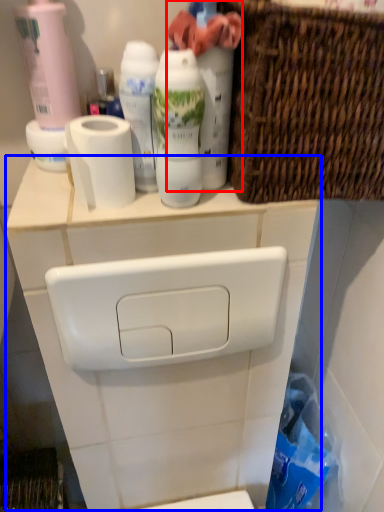
Question: Which point is closer to the camera, cleaning product (highlighted by a red box) or counter (highlighted by a blue box)?

Choices:
 (A) cleaning product
 (B) counter

Answer: (A)